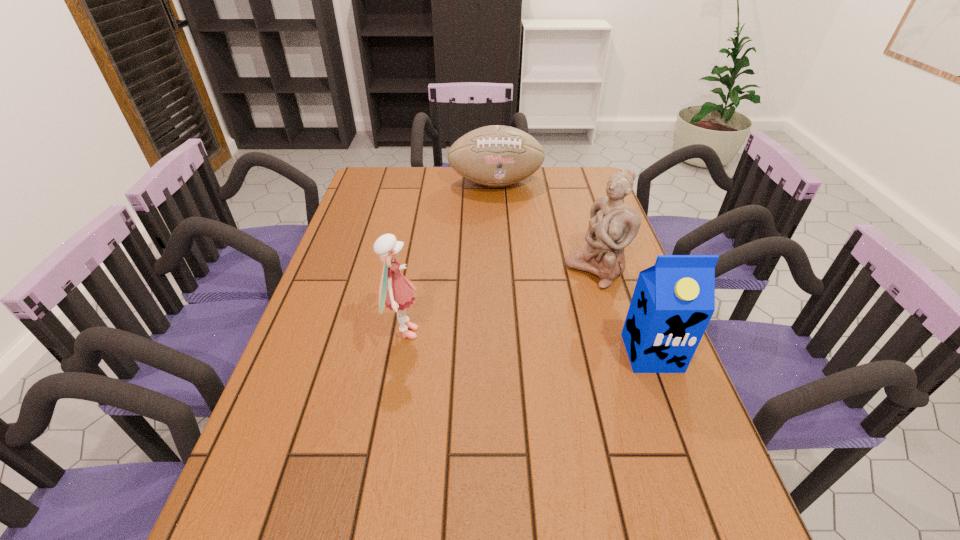
What are the coordinates of `doll` in the screenshot? It's located at (395, 292).

This screenshot has height=540, width=960. I want to click on carton, so click(x=673, y=301).

Where is `football (American)`? football (American) is located at coordinates (496, 156).

I want to click on the second object from left to right, so click(x=496, y=156).

The height and width of the screenshot is (540, 960). What are the coordinates of `figurine` in the screenshot? It's located at (613, 225).

Where is `free spot located on the front-facing side of the leftmost object`? This screenshot has width=960, height=540. free spot located on the front-facing side of the leftmost object is located at coordinates (476, 333).

At what (x,y) coordinates should I click in order to perform the action: click on free region located 0.210m with the cap open on the carton. Please return your answer as a coordinate pair (x, y). Looking at the image, I should click on (692, 461).

At what (x,y) coordinates should I click in order to perform the action: click on vacant region located on the laces of the farthest object. Please return your answer as a coordinate pair (x, y). This screenshot has height=540, width=960. Looking at the image, I should click on (505, 211).

Where is `vacant space located on the laces of the farthest object`? The height and width of the screenshot is (540, 960). vacant space located on the laces of the farthest object is located at coordinates (506, 218).

Identify the location of free region located 0.250m on the laces of the farthest object. (512, 238).